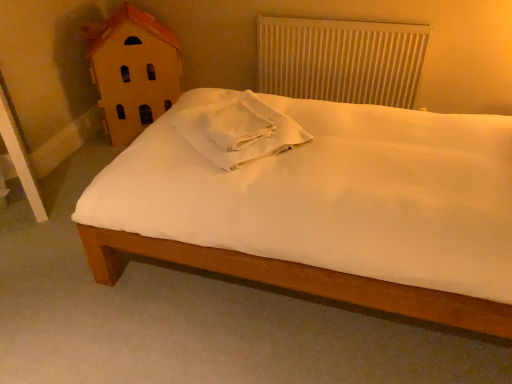
Where is `empty space that is ontop of white textured radiator at upper center (from a real-world perspective)`? This screenshot has width=512, height=384. empty space that is ontop of white textured radiator at upper center (from a real-world perspective) is located at coordinates (343, 22).